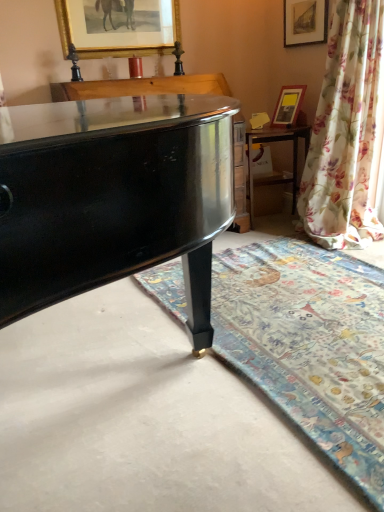
Locate an element on the screen. The image size is (384, 512). vacant space to the left of floral fabric curtain at right is located at coordinates (273, 246).